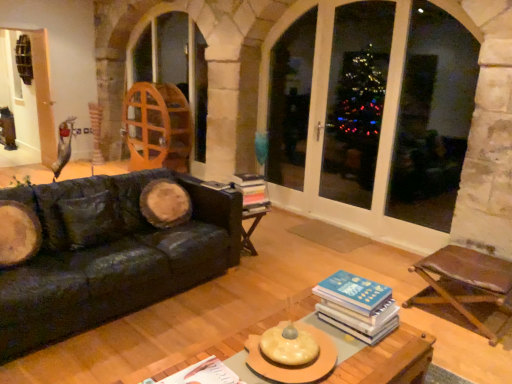
At what (x,y) coordinates should I click in order to perform the action: click on free spot in front of transparent glass screen door at center, positioned as the second screen door in back-to-front order. Please return your answer as a coordinate pair (x, y). Looking at the image, I should click on (339, 268).